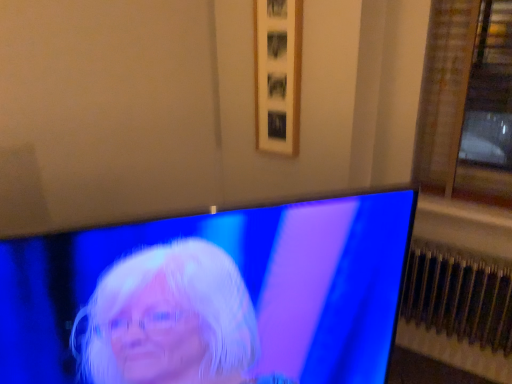
Question: Is shiny blue screen at center to the left of wooden picture frame at upper center from the viewer's perspective?

Choices:
 (A) no
 (B) yes

Answer: (B)

Question: Is wooden picture frame at upper center completely or partially inside shiny blue screen at center?

Choices:
 (A) no
 (B) yes

Answer: (A)

Question: From a real-world perspective, is shiny blue screen at center on wooden picture frame at upper center?

Choices:
 (A) no
 (B) yes

Answer: (A)

Question: Is shiny blue screen at center with wooden picture frame at upper center?

Choices:
 (A) no
 (B) yes

Answer: (A)

Question: Does shiny blue screen at center have a smaller size compared to wooden picture frame at upper center?

Choices:
 (A) no
 (B) yes

Answer: (A)

Question: Considering the relative positions of shiny blue screen at center and wooden picture frame at upper center in the image provided, is shiny blue screen at center behind wooden picture frame at upper center?

Choices:
 (A) yes
 (B) no

Answer: (B)

Question: Considering the relative sizes of wooden picture frame at upper center and shiny blue screen at center in the image provided, is wooden picture frame at upper center taller than shiny blue screen at center?

Choices:
 (A) yes
 (B) no

Answer: (A)

Question: From a real-world perspective, is wooden picture frame at upper center located higher than shiny blue screen at center?

Choices:
 (A) no
 (B) yes

Answer: (B)

Question: Considering the relative sizes of wooden picture frame at upper center and shiny blue screen at center in the image provided, is wooden picture frame at upper center smaller than shiny blue screen at center?

Choices:
 (A) no
 (B) yes

Answer: (B)

Question: Is wooden picture frame at upper center turned away from shiny blue screen at center?

Choices:
 (A) no
 (B) yes

Answer: (A)

Question: Considering the relative sizes of wooden picture frame at upper center and shiny blue screen at center in the image provided, is wooden picture frame at upper center shorter than shiny blue screen at center?

Choices:
 (A) yes
 (B) no

Answer: (B)

Question: Is wooden picture frame at upper center behind shiny blue screen at center?

Choices:
 (A) yes
 (B) no

Answer: (A)

Question: Is the position of metallic silver radiator at lower right less distant than that of shiny blue screen at center?

Choices:
 (A) yes
 (B) no

Answer: (B)